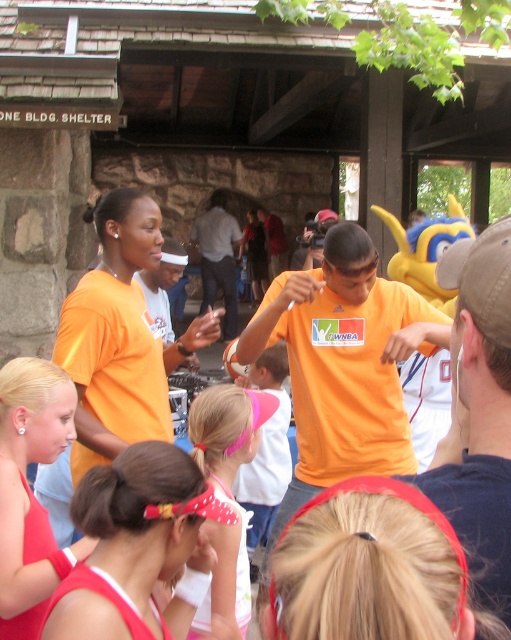
Question: Which point is closer to the camera taking this photo?

Choices:
 (A) (208, 440)
 (B) (36, 616)

Answer: (B)

Question: Which of the following is the closest to the observer?

Choices:
 (A) matte red swimsuit at lower left
 (B) pink fabric headband at center

Answer: (A)

Question: Observing the image, what is the correct spatial positioning of matte red swimsuit at lower left in reference to pink fabric headband at center?

Choices:
 (A) right
 (B) left

Answer: (B)

Question: Can you confirm if matte red swimsuit at lower left is positioned to the left of pink fabric headband at center?

Choices:
 (A) no
 (B) yes

Answer: (B)

Question: Does matte red swimsuit at lower left have a greater width compared to pink fabric headband at center?

Choices:
 (A) no
 (B) yes

Answer: (B)